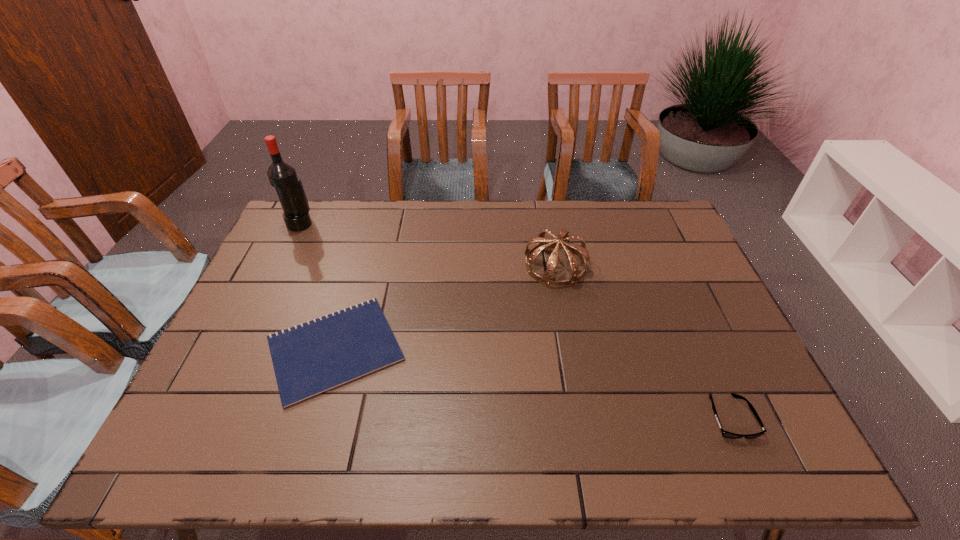
Find the location of `vacant space situated on the right of the shortest object`. vacant space situated on the right of the shortest object is located at coordinates (497, 349).

The height and width of the screenshot is (540, 960). Identify the location of object that is at the far edge. (282, 175).

Where is `object that is positioned at the near edge`? Image resolution: width=960 pixels, height=540 pixels. object that is positioned at the near edge is located at coordinates (725, 434).

This screenshot has width=960, height=540. I want to click on wine bottle that is at the left edge, so click(282, 175).

Locate an element on the screen. This screenshot has height=540, width=960. notepad present at the left edge is located at coordinates (314, 357).

Locate an element on the screen. object at the right edge is located at coordinates (725, 434).

Find the location of a particular element. The width and height of the screenshot is (960, 540). object that is at the far left corner is located at coordinates (282, 175).

What are the coordinates of `object situated at the near right corner` in the screenshot? It's located at (725, 434).

Where is `vacant region at the far edge of the desktop`? The width and height of the screenshot is (960, 540). vacant region at the far edge of the desktop is located at coordinates (551, 209).

In order to click on vacant space at the near edge of the desktop in this screenshot , I will do `click(624, 466)`.